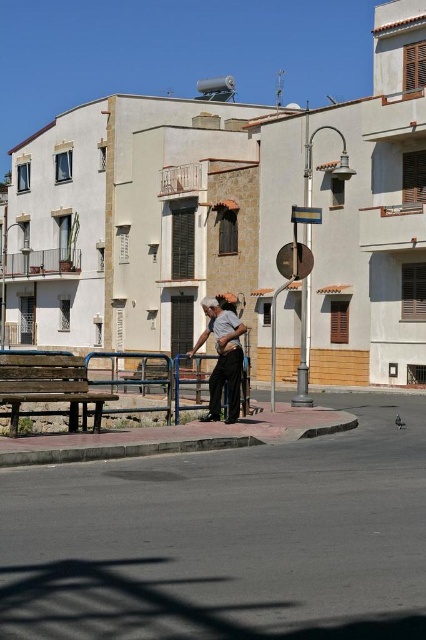
Question: Among these points, which one is farthest from the camera?

Choices:
 (A) (29, 387)
 (B) (224, 381)

Answer: (B)

Question: Does wooden bench at lower left appear under dark gray fabric pants at center?

Choices:
 (A) yes
 (B) no

Answer: (A)

Question: Is wooden bench at lower left to the right of dark gray fabric pants at center from the viewer's perspective?

Choices:
 (A) yes
 (B) no

Answer: (B)

Question: Which object is closer to the camera taking this photo?

Choices:
 (A) wooden bench at lower left
 (B) dark gray fabric pants at center

Answer: (A)

Question: Does wooden bench at lower left have a lesser width compared to dark gray fabric pants at center?

Choices:
 (A) yes
 (B) no

Answer: (B)